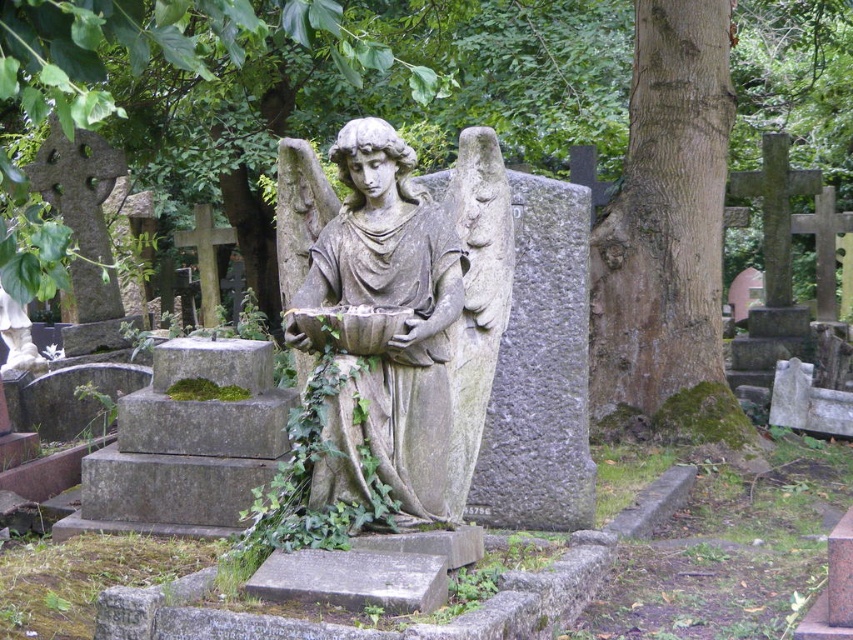
Question: Considering the relative positions of stone statue at center and green mossy bark at center in the image provided, where is stone statue at center located with respect to green mossy bark at center?

Choices:
 (A) below
 (B) above

Answer: (A)

Question: Is stone statue at center wider than green mossy bark at center?

Choices:
 (A) no
 (B) yes

Answer: (A)

Question: Which of the following is the farthest from the observer?

Choices:
 (A) (508, 202)
 (B) (701, 40)

Answer: (B)

Question: Does stone statue at center have a greater width compared to green mossy bark at center?

Choices:
 (A) yes
 (B) no

Answer: (B)